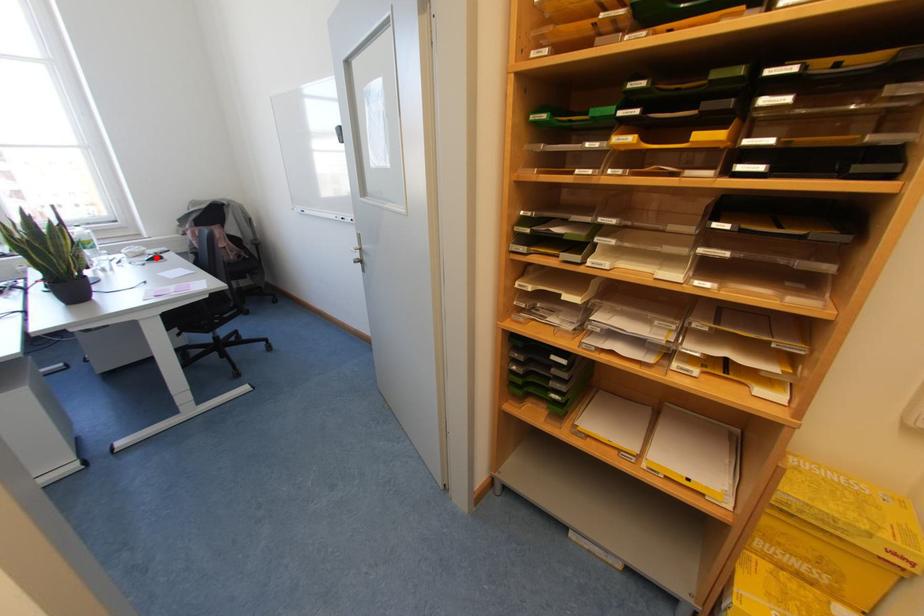
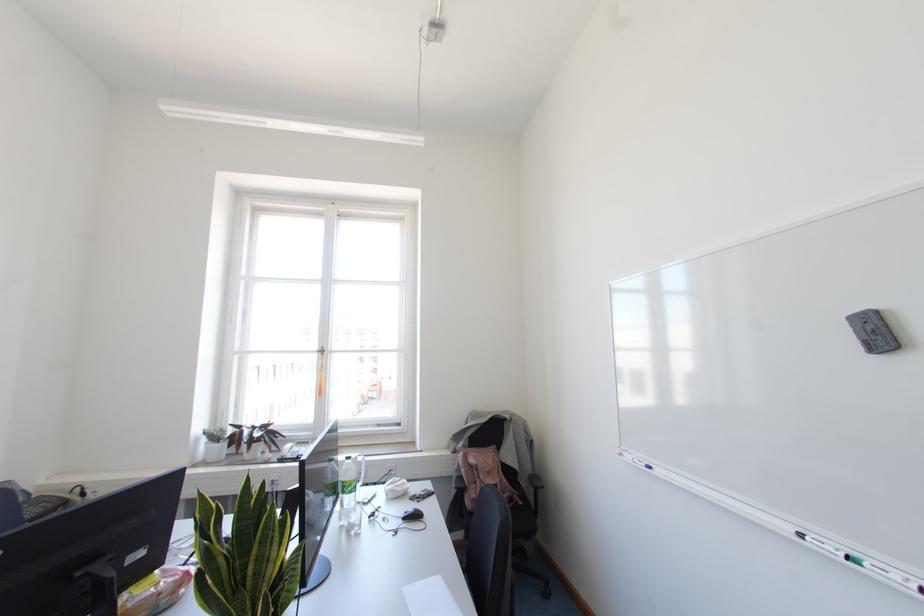
In the second image, find the point that corresponds to the highlighted location in the first image.

(415, 516)